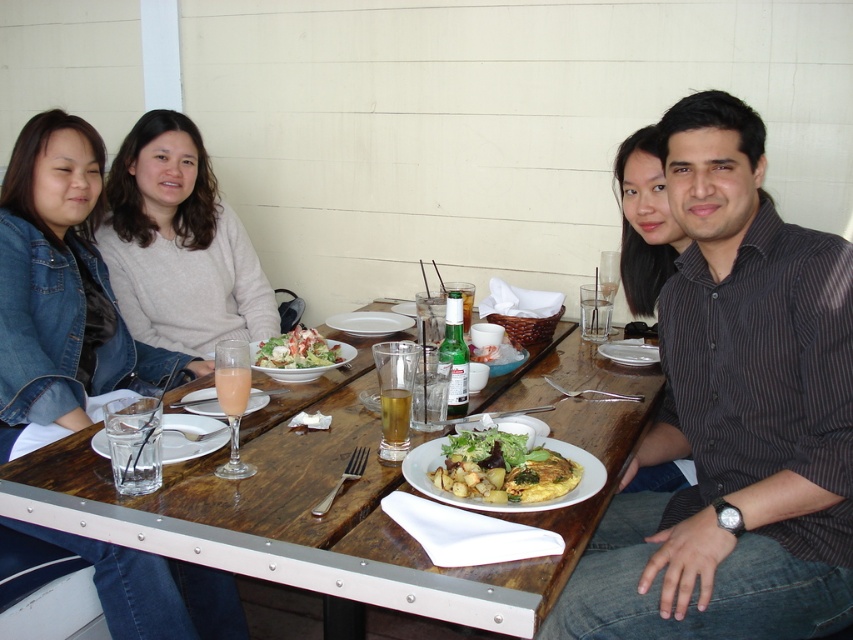
Who is lower down, smooth black hair at upper right or salad with croutons and dressing at center?

Positioned lower is salad with croutons and dressing at center.

Can you confirm if smooth black hair at upper right is smaller than salad with croutons and dressing at center?

No.

Does point (662, 257) lie behind point (305, 330)?

That is True.

At what (x,y) coordinates should I click in order to perform the action: click on smooth black hair at upper right. Please return your answer as a coordinate pair (x, y). This screenshot has width=853, height=640. Looking at the image, I should click on (643, 221).

Based on the photo, who is taller, green leafy salad with croutons at center or white matte plate at center?

green leafy salad with croutons at center is taller.

Can you confirm if green leafy salad with croutons at center is smaller than white matte plate at center?

No, green leafy salad with croutons at center is not smaller than white matte plate at center.

Does point (550, 481) come behind point (607, 348)?

No, it is in front of (607, 348).

This screenshot has width=853, height=640. Find the location of `green leafy salad with croutons at center`. green leafy salad with croutons at center is located at coordinates (503, 468).

Image resolution: width=853 pixels, height=640 pixels. Describe the element at coordinates (296, 349) in the screenshot. I see `salad with croutons and dressing at center` at that location.

Between salad with croutons and dressing at center and translucent glass at table center, which one has more height?

With more height is translucent glass at table center.

Is point (258, 362) positioned behind point (405, 440)?

Yes, it is behind point (405, 440).

In order to click on salad with croutons and dressing at center in this screenshot , I will do `click(296, 349)`.